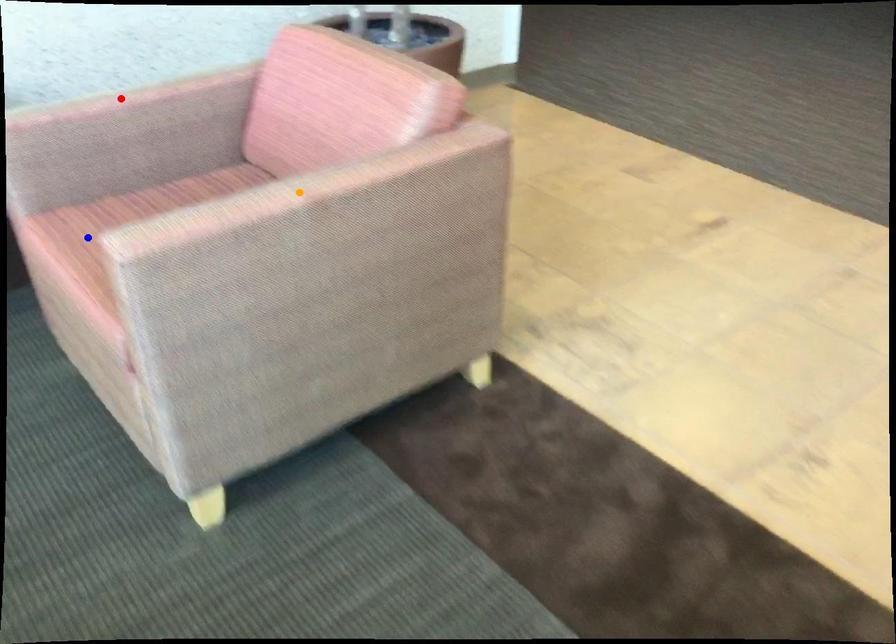
Order these from nearest to farthest:
1. red point
2. orange point
3. blue point

blue point → orange point → red point